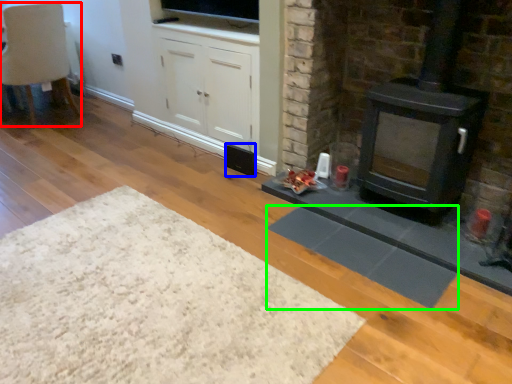
Question: Which object is the closest to the chair (highlighted by a red box)? Choose among these: speaker (highlighted by a blue box) or mat (highlighted by a green box).

Choices:
 (A) speaker
 (B) mat

Answer: (A)